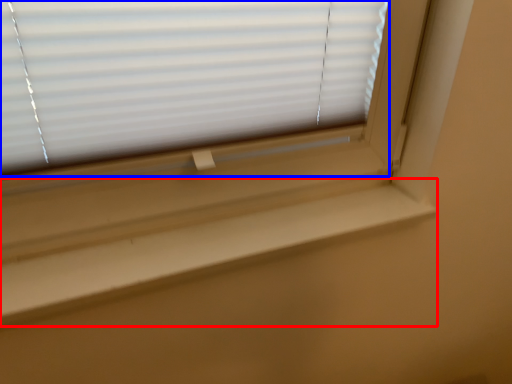
Question: Which object is closer to the camera taking this photo, window sill (highlighted by a red box) or window blind (highlighted by a blue box)?

Choices:
 (A) window sill
 (B) window blind

Answer: (B)